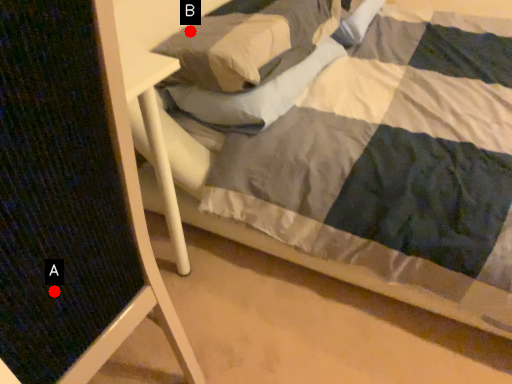
Question: Two points are circled on the image, labeled by A and B beside each circle. Which of the following is the closest to the observer?

Choices:
 (A) A is closer
 (B) B is closer

Answer: (A)